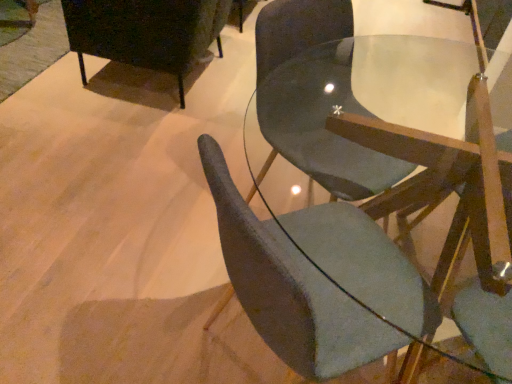
Locate an element on the screen. The width and height of the screenshot is (512, 384). matte gray chair at center, placed as the third chair when sorted from left to right is located at coordinates (463, 215).

In order to click on matte gray chair at center, the 2th chair in the left-to-right sequence in this screenshot , I will do `click(289, 289)`.

At what (x,y) coordinates should I click in order to perform the action: click on matte gray chair at center, acting as the first chair starting from the right. Please return your answer as a coordinate pair (x, y). Looking at the image, I should click on (463, 215).

At what (x,y) coordinates should I click in order to perform the action: click on chair above the matte gray chair at center, acting as the first chair starting from the right (from the image's perspective). Please return your answer as a coordinate pair (x, y). The image size is (512, 384). Looking at the image, I should click on (146, 32).

Is matte gray chair at center, acting as the first chair starting from the right, located within matte black cabinet at upper left, which is the first chair from left to right?

Definitely not — matte gray chair at center, acting as the first chair starting from the right, is not inside matte black cabinet at upper left, which is the first chair from left to right.

Between point (150, 9) and point (466, 148), which one is positioned in front?

The point (466, 148) is in front.

Is matte gray chair at center, placed as the third chair when sorted from left to right, oriented away from matte black cabinet at upper left, which is the first chair from left to right?

No, matte gray chair at center, placed as the third chair when sorted from left to right, is not facing the opposite direction of matte black cabinet at upper left, which is the first chair from left to right.

In the scene shown: From the image's perspective, which object appears higher, matte gray chair at center, acting as the first chair starting from the right, or matte black cabinet at upper left, which is the first chair from left to right?

matte black cabinet at upper left, which is the first chair from left to right, appears higher in the image.

Considering the positions of objects matte gray chair at center, acting as the first chair starting from the right, and matte black cabinet at upper left, which is the first chair from left to right, in the image provided, who is in front, matte gray chair at center, acting as the first chair starting from the right, or matte black cabinet at upper left, which is the first chair from left to right,?

matte gray chair at center, acting as the first chair starting from the right, is closer to the camera.

What's the angular difference between matte gray chair at center, placed as the third chair when sorted from left to right, and matte black cabinet at upper left, the third chair when ordered from right to left,'s facing directions?

They differ by 0.000505 degrees in their facing directions.

Who is shorter, matte gray chair at center, acting as the first chair starting from the right, or matte gray chair at center, the 2th chair positioned from the right?

matte gray chair at center, acting as the first chair starting from the right.

Looking at this image, from the image's perspective, is matte gray chair at center, placed as the third chair when sorted from left to right, above or below matte gray chair at center, the 2th chair in the left-to-right sequence?

Based on their image positions, matte gray chair at center, placed as the third chair when sorted from left to right, is located above matte gray chair at center, the 2th chair in the left-to-right sequence.

In the scene shown: Does matte gray chair at center, acting as the first chair starting from the right, have a greater width compared to matte gray chair at center, the 2th chair in the left-to-right sequence?

Yes, matte gray chair at center, acting as the first chair starting from the right, is wider than matte gray chair at center, the 2th chair in the left-to-right sequence.

Is the surface of matte gray chair at center, acting as the first chair starting from the right, in direct contact with matte gray chair at center, the 2th chair positioned from the right?

No, matte gray chair at center, acting as the first chair starting from the right, is not making contact with matte gray chair at center, the 2th chair positioned from the right.

How much distance is there between matte black cabinet at upper left, the third chair when ordered from right to left, and matte gray chair at center, the 2th chair positioned from the right?

4.72 feet.

Are matte black cabinet at upper left, which is the first chair from left to right, and matte gray chair at center, the 2th chair positioned from the right, located far from each other?

Yes, matte black cabinet at upper left, which is the first chair from left to right, is far from matte gray chair at center, the 2th chair positioned from the right.

Considering the relative positions of matte black cabinet at upper left, which is the first chair from left to right, and matte gray chair at center, the 2th chair in the left-to-right sequence, in the image provided, is matte black cabinet at upper left, which is the first chair from left to right, to the left or to the right of matte gray chair at center, the 2th chair in the left-to-right sequence,?

Clearly, matte black cabinet at upper left, which is the first chair from left to right, is on the left of matte gray chair at center, the 2th chair in the left-to-right sequence, in the image.

From the image's perspective, which one is positioned lower, matte black cabinet at upper left, which is the first chair from left to right, or matte gray chair at center, the 2th chair in the left-to-right sequence?

matte gray chair at center, the 2th chair in the left-to-right sequence, appears lower in the image.

Would you say matte gray chair at center, the 2th chair in the left-to-right sequence, contains matte gray chair at center, acting as the first chair starting from the right?

No, matte gray chair at center, acting as the first chair starting from the right, is located outside of matte gray chair at center, the 2th chair in the left-to-right sequence.

From the image's perspective, which object appears higher, matte gray chair at center, the 2th chair positioned from the right, or matte gray chair at center, placed as the third chair when sorted from left to right?

matte gray chair at center, placed as the third chair when sorted from left to right, appears higher in the image.

Relative to matte gray chair at center, acting as the first chair starting from the right, is matte gray chair at center, the 2th chair in the left-to-right sequence, in front or behind?

Clearly, matte gray chair at center, the 2th chair in the left-to-right sequence, is in front of matte gray chair at center, acting as the first chair starting from the right.

From the image's perspective, between matte gray chair at center, the 2th chair in the left-to-right sequence, and matte black cabinet at upper left, the third chair when ordered from right to left, which one is located above?

matte black cabinet at upper left, the third chair when ordered from right to left.

Is matte gray chair at center, the 2th chair positioned from the right, in front of or behind matte black cabinet at upper left, which is the first chair from left to right, in the image?

In the image, matte gray chair at center, the 2th chair positioned from the right, appears in front of matte black cabinet at upper left, which is the first chair from left to right.

Is matte gray chair at center, the 2th chair positioned from the right, facing away from matte black cabinet at upper left, the third chair when ordered from right to left?

That's not correct — matte gray chair at center, the 2th chair positioned from the right, is not looking away from matte black cabinet at upper left, the third chair when ordered from right to left.

You are a GUI agent. You are given a task and a screenshot of the screen. Output one action in this format:
    pyautogui.click(x=<x>, y=<y>)
    Task: Click on the chair above the matte gray chair at center, acting as the first chair starting from the right (from the image's perspective)
    This screenshot has height=384, width=512.
    Given the screenshot: What is the action you would take?
    pyautogui.click(x=146, y=32)

This screenshot has height=384, width=512. Find the location of `chair located underneath the matte gray chair at center, placed as the third chair when sorted from left to right (from a real-world perspective)`. chair located underneath the matte gray chair at center, placed as the third chair when sorted from left to right (from a real-world perspective) is located at coordinates (146, 32).

From the image, which object appears to be nearer to matte gray chair at center, acting as the first chair starting from the right, matte black cabinet at upper left, which is the first chair from left to right, or matte gray chair at center, the 2th chair in the left-to-right sequence?

matte gray chair at center, the 2th chair in the left-to-right sequence, lies closer to matte gray chair at center, acting as the first chair starting from the right, than the other object.

From the image, which object appears to be nearer to matte gray chair at center, placed as the third chair when sorted from left to right, matte gray chair at center, the 2th chair in the left-to-right sequence, or matte black cabinet at upper left, which is the first chair from left to right?

matte gray chair at center, the 2th chair in the left-to-right sequence.

Estimate the real-world distances between objects in this image. Which object is closer to matte gray chair at center, the 2th chair in the left-to-right sequence, matte black cabinet at upper left, the third chair when ordered from right to left, or matte gray chair at center, acting as the first chair starting from the right?

Among the two, matte gray chair at center, acting as the first chair starting from the right, is located nearer to matte gray chair at center, the 2th chair in the left-to-right sequence.

Estimate the real-world distances between objects in this image. Which object is further from matte gray chair at center, the 2th chair in the left-to-right sequence, matte gray chair at center, acting as the first chair starting from the right, or matte black cabinet at upper left, the third chair when ordered from right to left?

matte black cabinet at upper left, the third chair when ordered from right to left, is positioned further to the anchor matte gray chair at center, the 2th chair in the left-to-right sequence.

Looking at the image, which one is located further to matte black cabinet at upper left, which is the first chair from left to right, matte gray chair at center, the 2th chair positioned from the right, or matte gray chair at center, acting as the first chair starting from the right?

matte gray chair at center, the 2th chair positioned from the right, is further to matte black cabinet at upper left, which is the first chair from left to right.

Estimate the real-world distances between objects in this image. Which object is closer to matte black cabinet at upper left, which is the first chair from left to right, matte gray chair at center, acting as the first chair starting from the right, or matte gray chair at center, the 2th chair positioned from the right?

Among the two, matte gray chair at center, acting as the first chair starting from the right, is located nearer to matte black cabinet at upper left, which is the first chair from left to right.

In order to click on chair between matte gray chair at center, the 2th chair positioned from the right, and matte black cabinet at upper left, the third chair when ordered from right to left, in the front-back direction in this screenshot , I will do `click(463, 215)`.